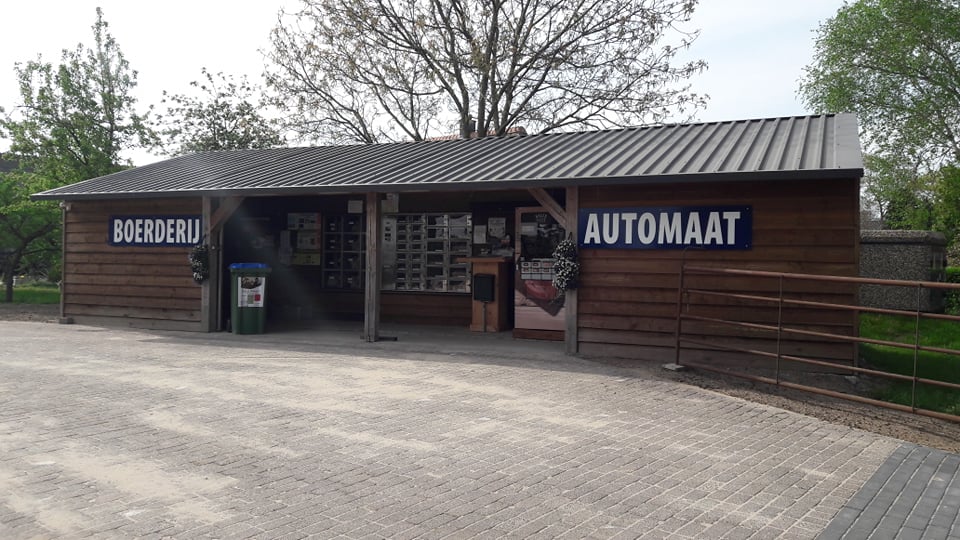
Locate an element on the screen. trash can is located at coordinates (245, 318).